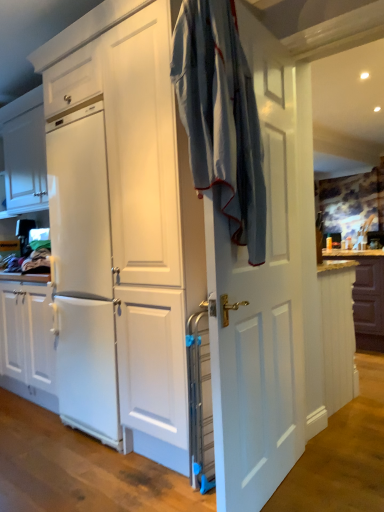
Question: Is brown wood countertop at right positioned with its back to white matte cabinet at right?

Choices:
 (A) yes
 (B) no

Answer: (B)

Question: Is brown wood countertop at right positioned behind white matte cabinet at right?

Choices:
 (A) no
 (B) yes

Answer: (B)

Question: Considering the relative sizes of brown wood countertop at right and white matte cabinet at right in the image provided, is brown wood countertop at right smaller than white matte cabinet at right?

Choices:
 (A) yes
 (B) no

Answer: (B)

Question: Does brown wood countertop at right have a greater height compared to white matte cabinet at right?

Choices:
 (A) no
 (B) yes

Answer: (A)

Question: Is the depth of brown wood countertop at right less than that of white matte cabinet at right?

Choices:
 (A) no
 (B) yes

Answer: (A)

Question: Considering the relative positions of white matte door at center and white matte cabinet at right in the image provided, is white matte door at center to the left or to the right of white matte cabinet at right?

Choices:
 (A) left
 (B) right

Answer: (A)

Question: In terms of size, does white matte door at center appear bigger or smaller than white matte cabinet at right?

Choices:
 (A) small
 (B) big

Answer: (B)

Question: Does point (233, 471) appear closer or farther from the camera than point (349, 286)?

Choices:
 (A) farther
 (B) closer

Answer: (B)

Question: From their relative heights in the image, would you say white matte door at center is taller or shorter than white matte cabinet at right?

Choices:
 (A) short
 (B) tall

Answer: (B)

Question: From their relative heights in the image, would you say white matte door at center is taller or shorter than light blue fabric at center?

Choices:
 (A) short
 (B) tall

Answer: (B)

Question: From the image's perspective, is white matte door at center positioned above or below light blue fabric at center?

Choices:
 (A) above
 (B) below

Answer: (B)

Question: Is white matte door at center inside the boundaries of light blue fabric at center, or outside?

Choices:
 (A) outside
 (B) inside

Answer: (A)

Question: From a real-world perspective, is white matte door at center positioned above or below light blue fabric at center?

Choices:
 (A) below
 (B) above

Answer: (A)

Question: In terms of width, does white matte cabinet at right look wider or thinner when compared to light blue fabric at center?

Choices:
 (A) thin
 (B) wide

Answer: (A)

Question: From a real-world perspective, is white matte cabinet at right physically located above or below light blue fabric at center?

Choices:
 (A) above
 (B) below

Answer: (B)